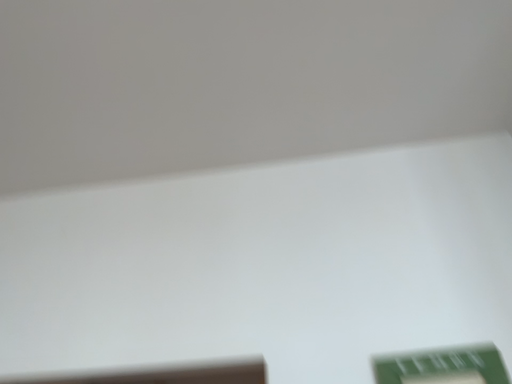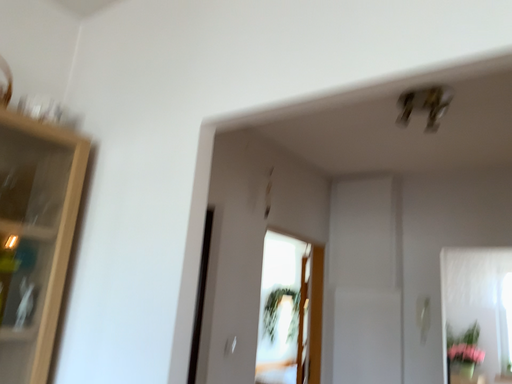
Question: How did the camera likely rotate when shooting the video?

Choices:
 (A) rotated downward
 (B) rotated upward

Answer: (A)